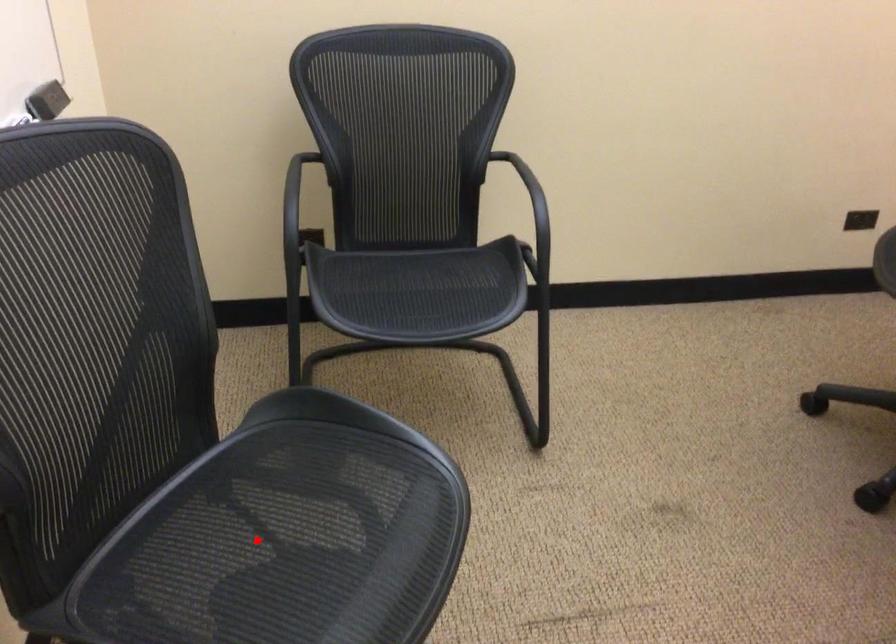
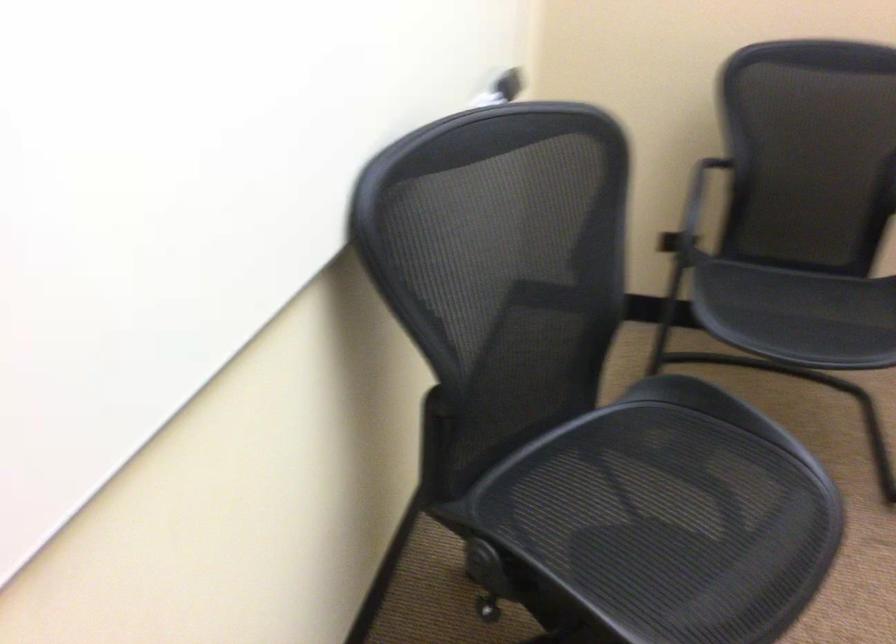
In the second image, find the point that corresponds to the highlighted location in the first image.

(634, 502)